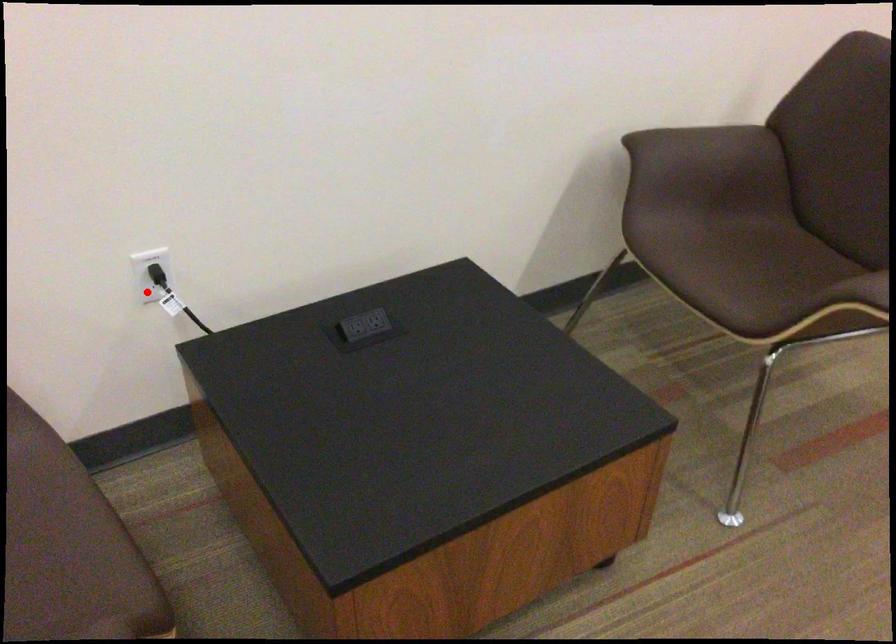
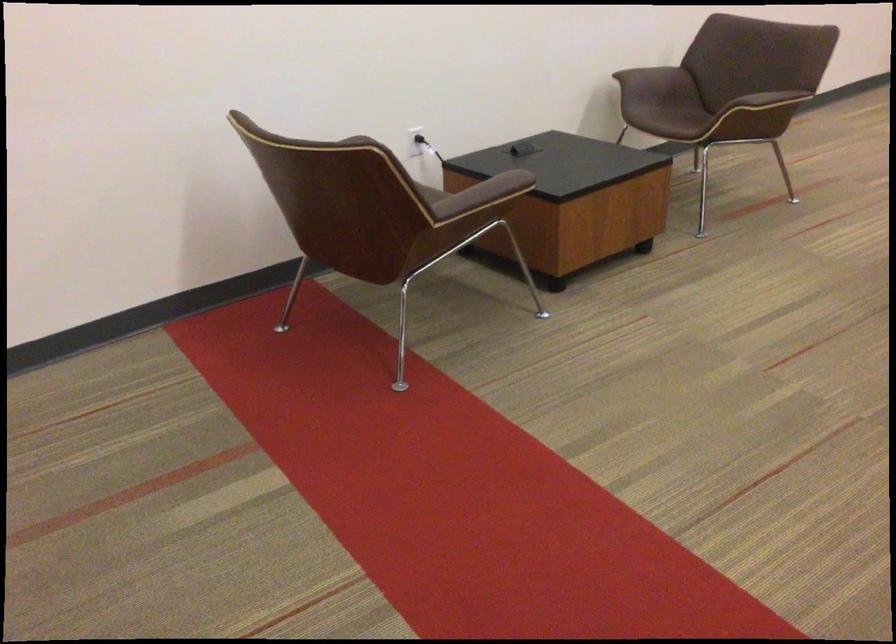
The point at the highlighted location is marked in the first image. Where is the corresponding point in the second image?

(415, 140)